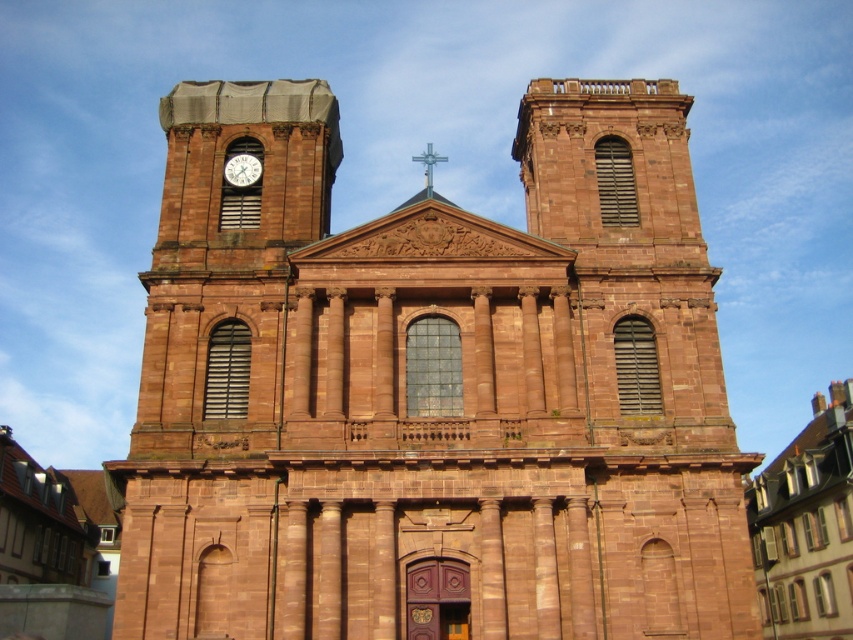
Question: Among these objects, which one is farthest from the camera?

Choices:
 (A) white glossy clock at upper left
 (B) metallic cross at upper center
 (C) brown stone church at center

Answer: (A)

Question: Is brown stone church at center wider than white glossy clock at upper left?

Choices:
 (A) yes
 (B) no

Answer: (A)

Question: Is white glossy clock at upper left positioned behind metallic cross at upper center?

Choices:
 (A) yes
 (B) no

Answer: (A)

Question: Does brown stone church at center appear on the left side of metallic cross at upper center?

Choices:
 (A) yes
 (B) no

Answer: (A)

Question: Among these points, which one is farthest from the camera?

Choices:
 (A) (428, 152)
 (B) (239, 172)
 (C) (496, 300)

Answer: (A)

Question: Which point is farther to the camera?

Choices:
 (A) brown stone church at center
 (B) metallic cross at upper center
 (C) white glossy clock at upper left

Answer: (C)